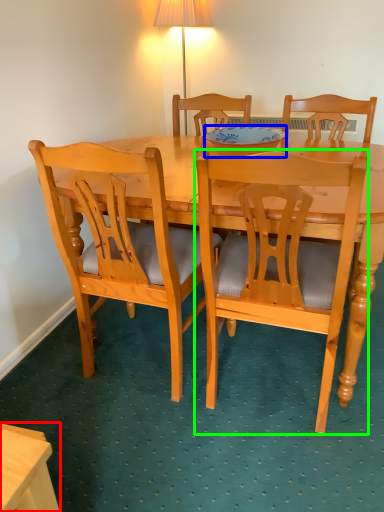
Question: Which object is positioned farthest from desk (highlighted by a red box)? Select from bowl (highlighted by a blue box) and chair (highlighted by a green box).

Choices:
 (A) bowl
 (B) chair

Answer: (A)